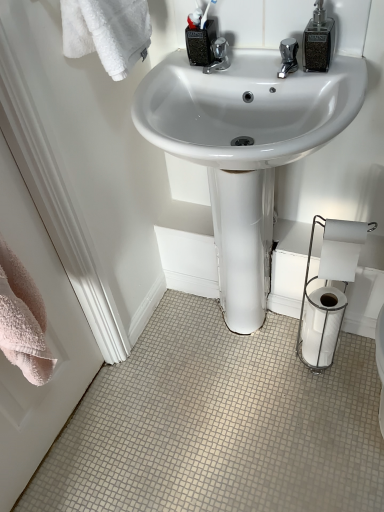
Question: Is white glossy toilet paper at lower right, which is the 1th toilet paper in bottom-to-top order, a part of pink towel at left?

Choices:
 (A) no
 (B) yes

Answer: (A)

Question: From the image's perspective, is pink towel at left above white glossy toilet paper at lower right, which is counted as the 3th toilet paper, starting from the top?

Choices:
 (A) yes
 (B) no

Answer: (A)

Question: Can you confirm if pink towel at left is wider than white glossy toilet paper at lower right, which is the 1th toilet paper in bottom-to-top order?

Choices:
 (A) yes
 (B) no

Answer: (B)

Question: Can you confirm if pink towel at left is taller than white glossy toilet paper at lower right, which is the 1th toilet paper in bottom-to-top order?

Choices:
 (A) no
 (B) yes

Answer: (B)

Question: From the image's perspective, is pink towel at left below white glossy toilet paper at lower right, which is the 1th toilet paper in bottom-to-top order?

Choices:
 (A) yes
 (B) no

Answer: (B)

Question: Can you confirm if pink towel at left is thinner than white glossy toilet paper at lower right, which is counted as the 3th toilet paper, starting from the top?

Choices:
 (A) yes
 (B) no

Answer: (A)

Question: Are white glossy toilet paper at lower right, which is the 1th toilet paper in bottom-to-top order, and white matte toilet paper at lower right, the first toilet paper from the top, beside each other?

Choices:
 (A) yes
 (B) no

Answer: (B)

Question: Are white glossy toilet paper at lower right, which is the 1th toilet paper in bottom-to-top order, and white matte toilet paper at lower right, the first toilet paper from the top, far apart?

Choices:
 (A) no
 (B) yes

Answer: (A)

Question: From the image's perspective, is white glossy toilet paper at lower right, which is counted as the 3th toilet paper, starting from the top, on top of white matte toilet paper at lower right, which is the 3th toilet paper from bottom to top?

Choices:
 (A) no
 (B) yes

Answer: (A)

Question: From the image's perspective, would you say white glossy toilet paper at lower right, which is counted as the 3th toilet paper, starting from the top, is shown under white matte toilet paper at lower right, which is the 3th toilet paper from bottom to top?

Choices:
 (A) no
 (B) yes

Answer: (B)

Question: Is white glossy toilet paper at lower right, which is the 1th toilet paper in bottom-to-top order, to the right of white matte toilet paper at lower right, the first toilet paper from the top, from the viewer's perspective?

Choices:
 (A) yes
 (B) no

Answer: (A)

Question: Is white glossy toilet paper at lower right, which is the 1th toilet paper in bottom-to-top order, positioned with its back to white matte toilet paper at lower right, which is the 3th toilet paper from bottom to top?

Choices:
 (A) yes
 (B) no

Answer: (B)

Question: Would you say white glossy sink at center is part of white glossy toilet paper at lower right, which is the 1th toilet paper in bottom-to-top order,'s contents?

Choices:
 (A) yes
 (B) no

Answer: (B)